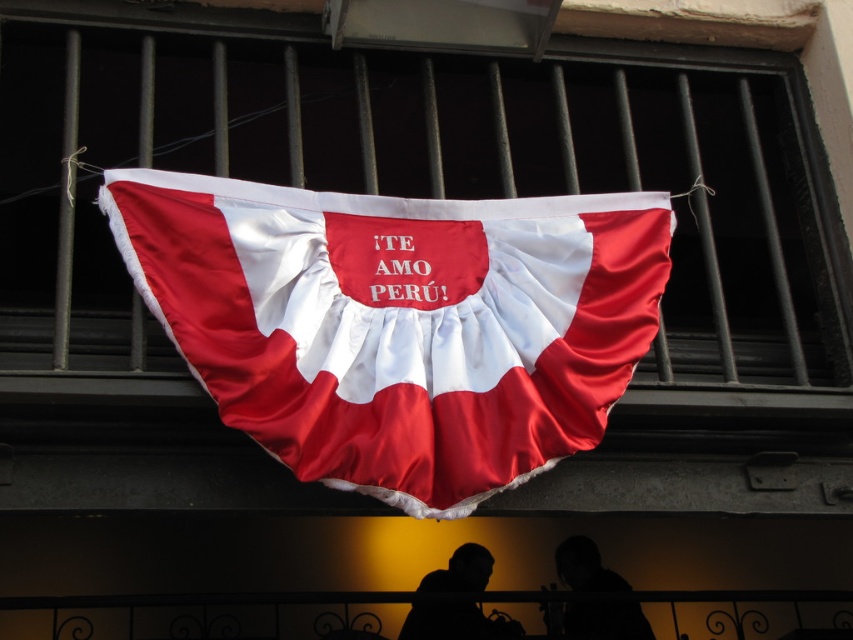
Which is above, matte fabric banner at center or silhouette fabric at center?

Positioned higher is matte fabric banner at center.

Is point (703, 99) less distant than point (634, 634)?

Yes.

Locate an element on the screen. Image resolution: width=853 pixels, height=640 pixels. matte fabric banner at center is located at coordinates (422, 180).

Does black wrought iron railing at lower center have a larger size compared to silhouette fabric at center?

Correct, black wrought iron railing at lower center is larger in size than silhouette fabric at center.

Who is positioned more to the right, black wrought iron railing at lower center or silhouette fabric at center?

From the viewer's perspective, silhouette fabric at center appears more on the right side.

Identify the location of black wrought iron railing at lower center. (402, 612).

Which is below, silhouette fabric at center or silhouette figure at center?

silhouette fabric at center

Between point (567, 572) and point (428, 637), which one is positioned in front?

Point (428, 637) is in front.

Locate an element on the screen. This screenshot has height=640, width=853. silhouette fabric at center is located at coordinates (592, 598).